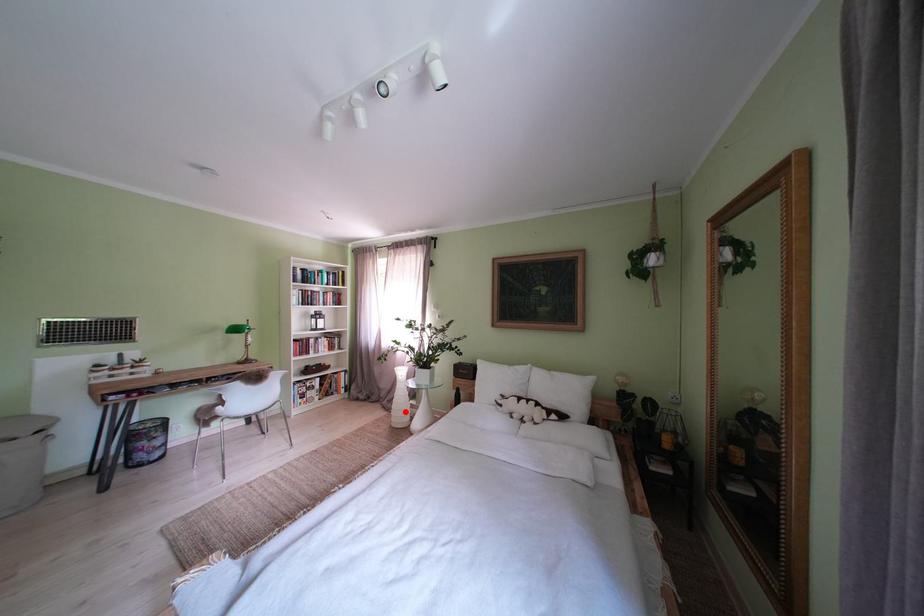
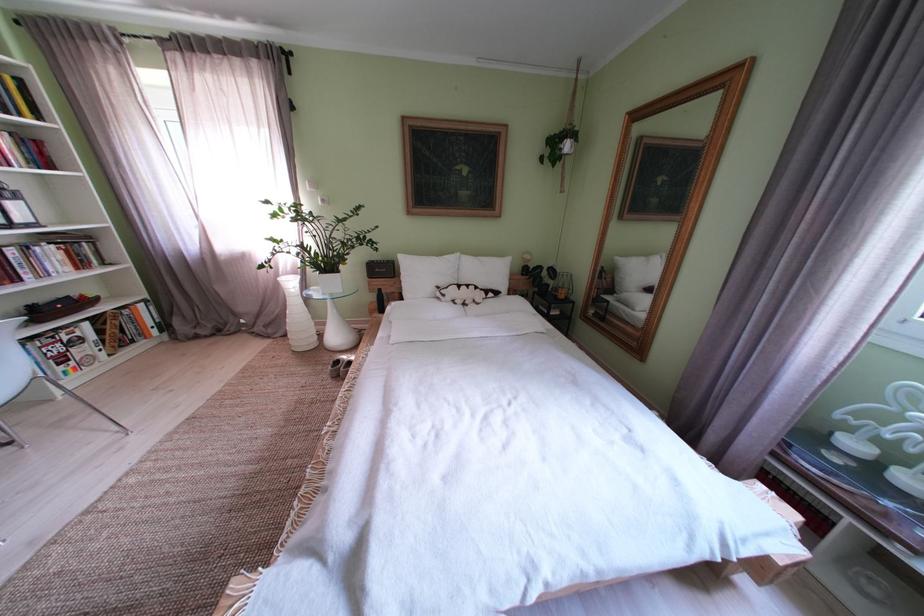
Question: I am providing you with two images of the same scene from different viewpoints. A red point is marked on the first image. Is the red point's position out of view in image 2?

Choices:
 (A) Yes
 (B) No

Answer: (B)